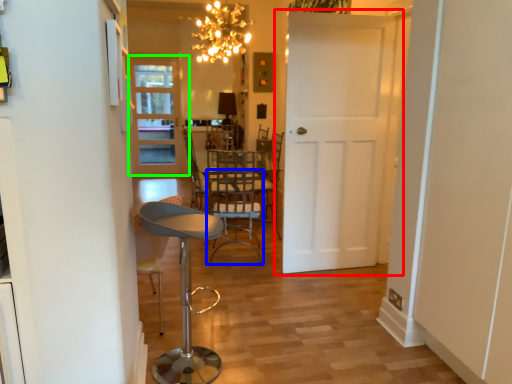
Question: Estimate the real-world distances between objects in this image. Which object is closer to door (highlighted by a red box), armchair (highlighted by a blue box) or door (highlighted by a green box)?

Choices:
 (A) armchair
 (B) door

Answer: (A)